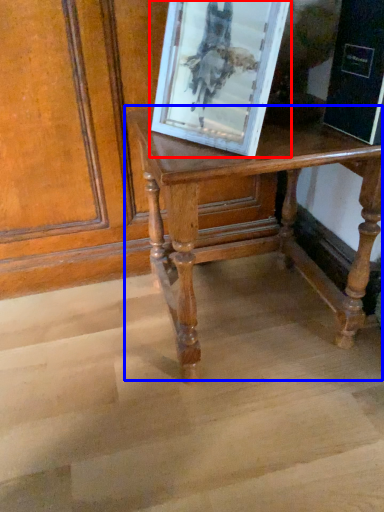
Question: Which object appears farthest to the camera in this image, picture frame (highlighted by a red box) or table (highlighted by a blue box)?

Choices:
 (A) picture frame
 (B) table

Answer: (B)